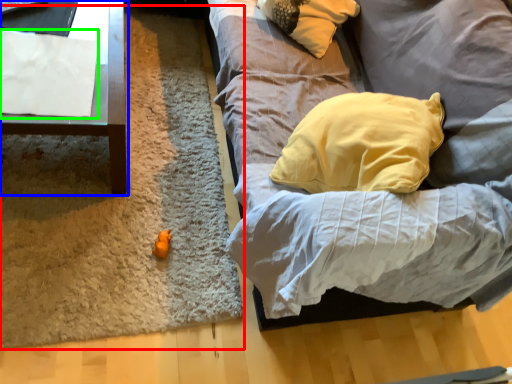
Question: Which is farther away from mat (highlighted by a red box)? furniture (highlighted by a blue box) or sheet (highlighted by a green box)?

Choices:
 (A) furniture
 (B) sheet

Answer: (B)